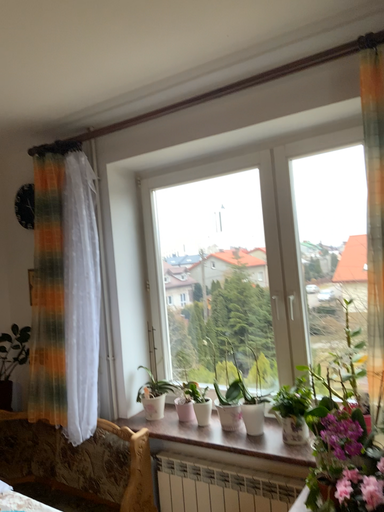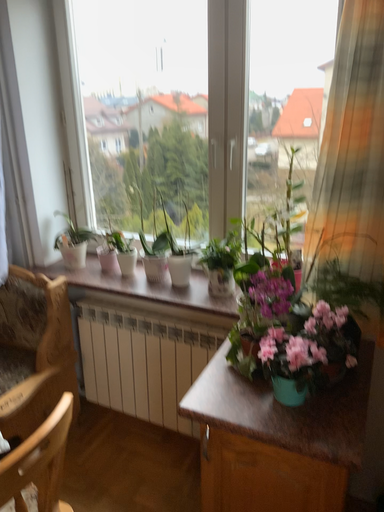
Question: Which way did the camera rotate in the video?

Choices:
 (A) rotated upward
 (B) rotated downward

Answer: (B)